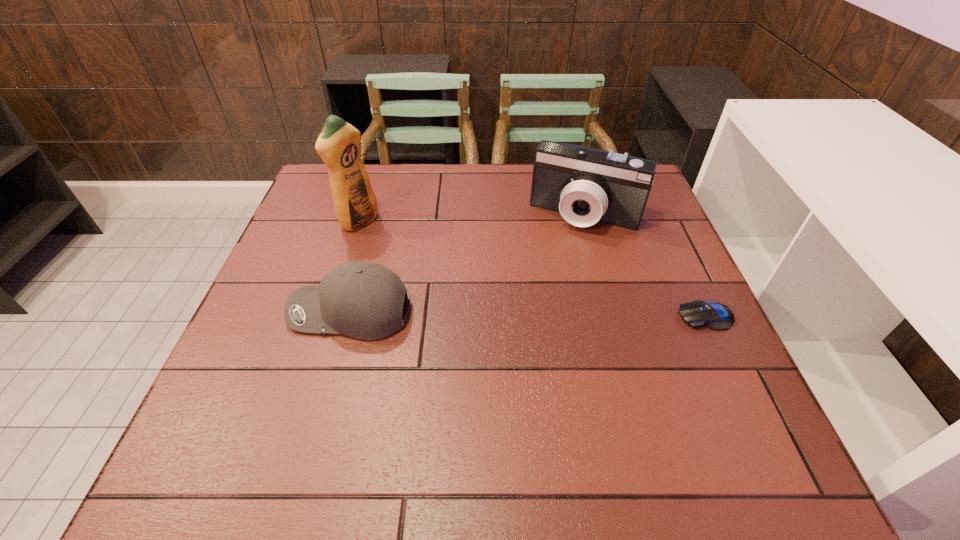
Where is `free space on the desktop that is between the baseball cap and the computer mouse and is positioned on the lens of the camcorder`? The width and height of the screenshot is (960, 540). free space on the desktop that is between the baseball cap and the computer mouse and is positioned on the lens of the camcorder is located at coordinates (545, 314).

Find the location of `vacant space on the desktop that is between the third tallest object and the computer mouse and is positioned on the label of the tallest object`. vacant space on the desktop that is between the third tallest object and the computer mouse and is positioned on the label of the tallest object is located at coordinates (533, 314).